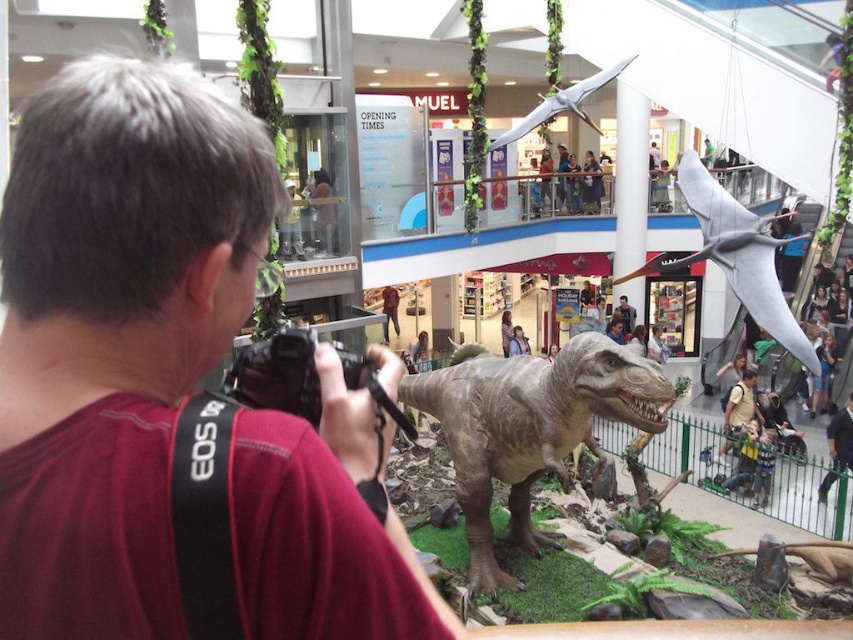
You are a photographer standing in the shopping mall and see the maroon fabric shirt at center and the gray textured dinosaur at center. Which object is smaller in size?

The maroon fabric shirt at center is smaller in size compared to the gray textured dinosaur at center.

You are standing at the entrance of the shopping mall and see the light brown leather jacket at upper center and the smooth brown leather jacket at center. Which jacket is closer to you?

The smooth brown leather jacket at center is closer to you since it is only 5.92 meters away from the light brown leather jacket at upper center, but the description does not specify which one is closer. Wait, the description says the distance between them is 5.92 meters, but it doesn not indicate which is closer to the viewer. Hmm, maybe I need to recheck the rules. The Objects Description must be used to provide the answer. The problem is that the description only gives the distance between the two, not a